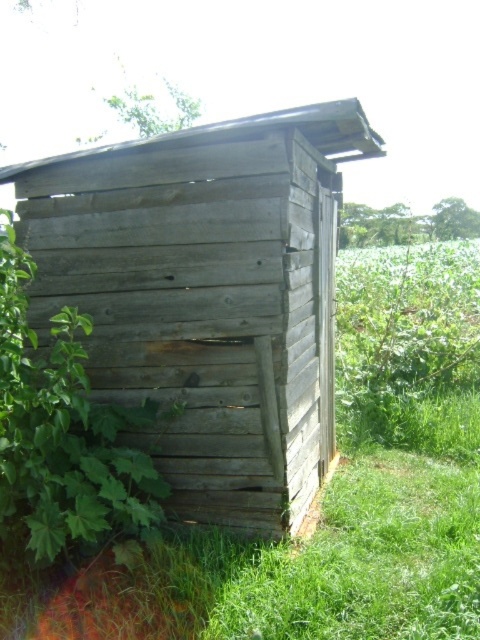
Question: Is weathered wood hut at center smaller than green leafy plant at left?

Choices:
 (A) no
 (B) yes

Answer: (A)

Question: Can you confirm if weathered wood hut at center is positioned to the left of green leafy plant at left?

Choices:
 (A) yes
 (B) no

Answer: (B)

Question: Which point is closer to the camera taking this photo?

Choices:
 (A) (40, 435)
 (B) (244, 192)

Answer: (A)

Question: Is weathered wood hut at center above green leafy plant at left?

Choices:
 (A) no
 (B) yes

Answer: (B)